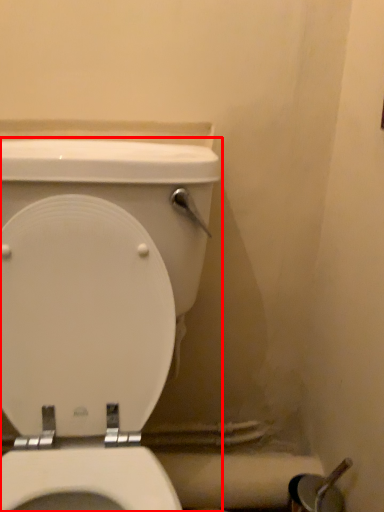
Question: From the image's perspective, what is the correct spatial positioning of toilet (annotated by the red box) in reference to toilet paper?

Choices:
 (A) above
 (B) below

Answer: (A)